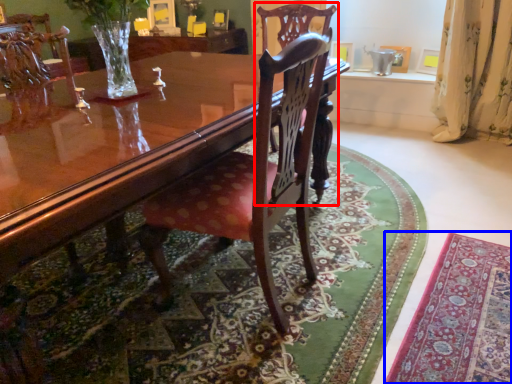
Question: Which of the following is the farthest to the observer, chair (highlighted by a red box) or mat (highlighted by a blue box)?

Choices:
 (A) chair
 (B) mat

Answer: (A)